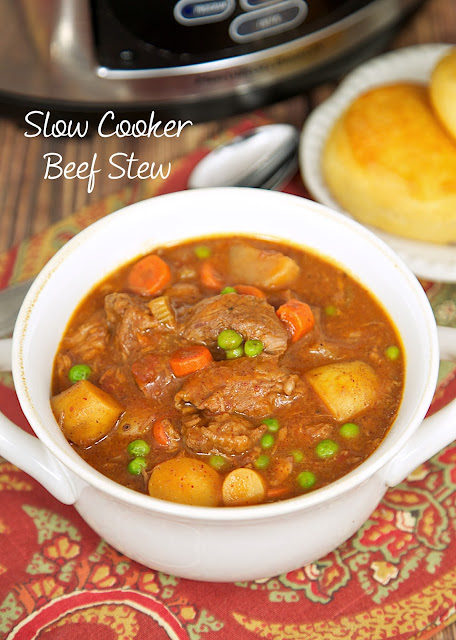
You are a GUI agent. You are given a task and a screenshot of the screen. Output one action in this format:
    pyautogui.click(x=<x>, y=<y>)
    Task: Click on the handle
    
    Given the screenshot: What is the action you would take?
    pyautogui.click(x=11, y=449)